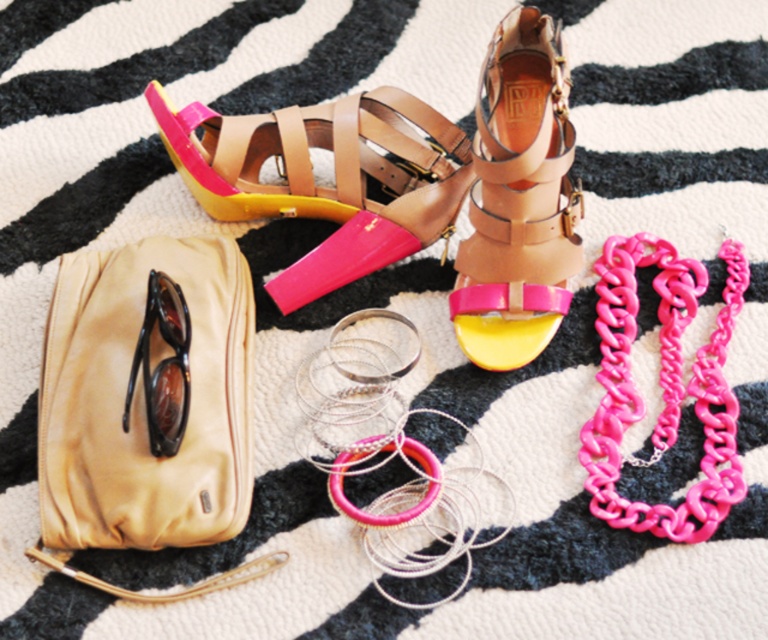
You are arranging a display of footwear and see the pink matte leather sandal at center and the tan leather sandal at center. Which sandal is positioned to the left?

The pink matte leather sandal at center is positioned to the left of the tan leather sandal at center.

You are organizing a fashion display and need to place the tan leather bag at left and the tan leather sandal at center on a shelf. If the shelf has limited vertical space, which item should you place first to ensure it fits?

The tan leather bag at left is shorter than the tan leather sandal at center, so you should place the tan leather sandal at center first to accommodate its height and then the tan leather bag at left.

You are standing at the origin of the coordinate system. You want to place a new accessory at point A which is 0.1 units to the right of the point marked by point (518, 198). What is the coordinate of point A?

The coordinate of point A is 0.412, 0.676.